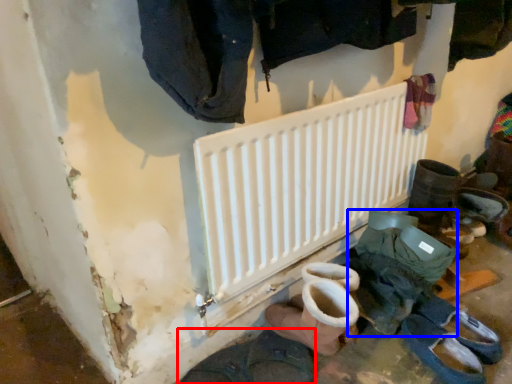
Question: Which point is further to the camera, footwear (highlighted by a red box) or footwear (highlighted by a blue box)?

Choices:
 (A) footwear
 (B) footwear

Answer: (B)